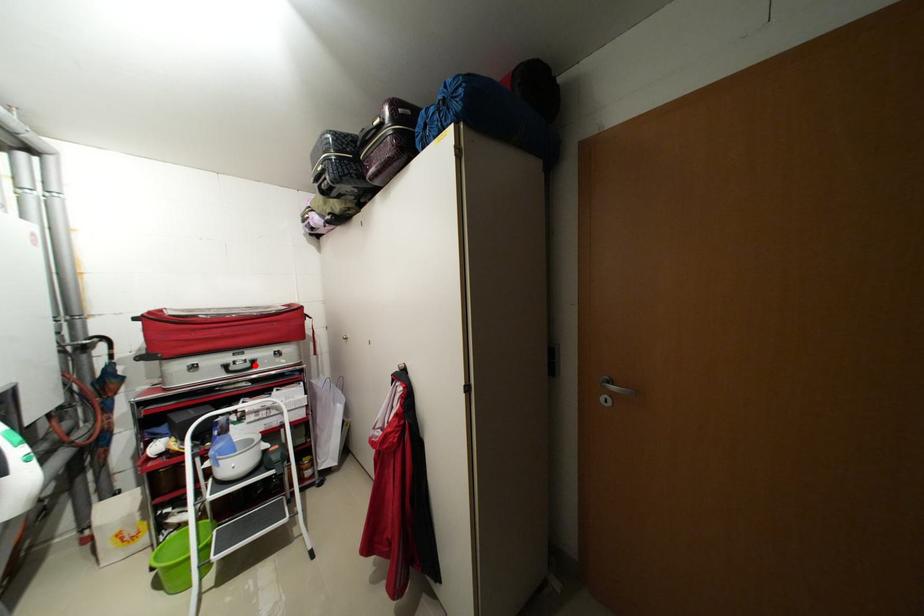
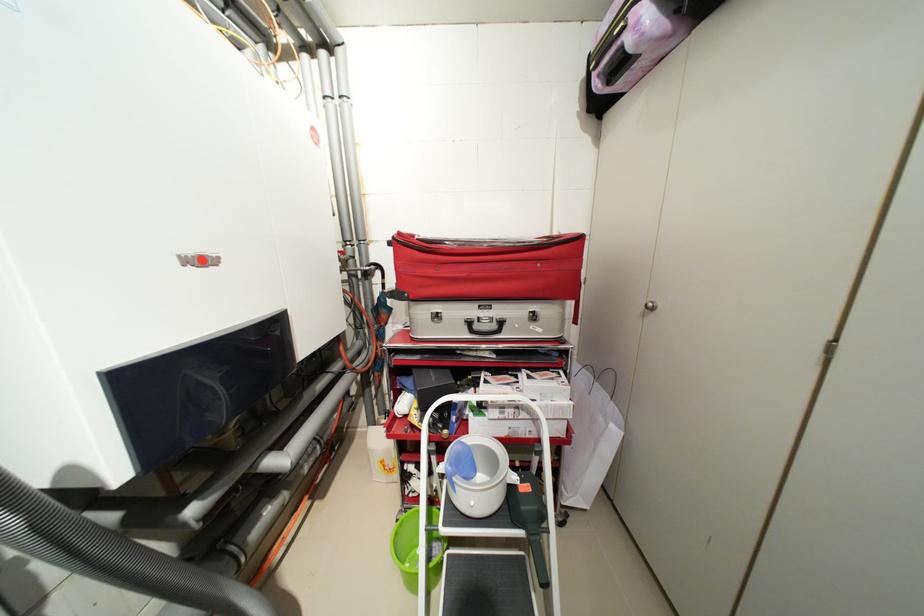
In the second image, find the point that corresponds to the highlighted location in the first image.

(502, 326)